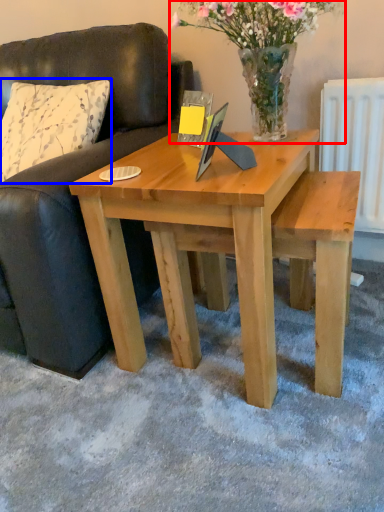
Question: Which object appears closest to the camera in this image, floral arrangement (highlighted by a red box) or pillow (highlighted by a blue box)?

Choices:
 (A) floral arrangement
 (B) pillow

Answer: (A)